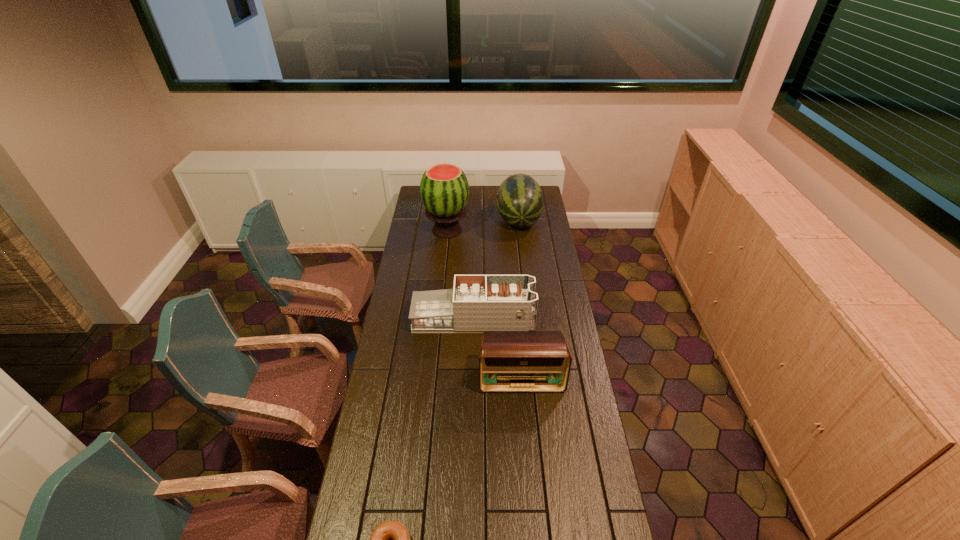
Identify the location of vacant space in between the right watermelon and the left watermelon. The image size is (960, 540). (483, 225).

Find the location of `empty space between the right watermelon and the tallest object`. empty space between the right watermelon and the tallest object is located at coordinates (483, 225).

Choose which object is the nearest neighbor to the left watermelon. Please provide its 2D coordinates. Your answer should be formatted as a tuple, i.e. [(x, y)], where the tuple contains the x and y coordinates of a point satisfying the conditions above.

[(520, 200)]

At what (x,y) coordinates should I click in order to perform the action: click on object that is the nearest to the nearest object. Please return your answer as a coordinate pair (x, y). Looking at the image, I should click on (510, 361).

Locate an element on the screen. free spot that satisfies the following two spatial constraints: 1. on the front side of the right watermelon; 2. at the entrance of the dollhouse is located at coordinates point(531,320).